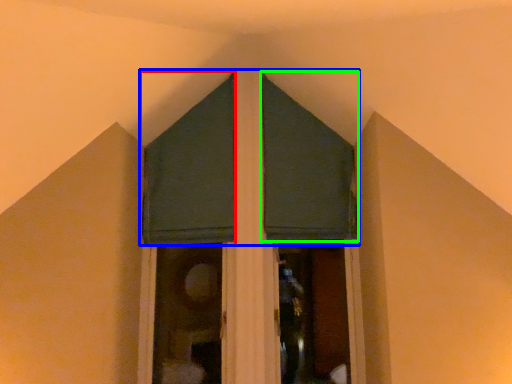
Question: Considering the real-world distances, which object is farthest from curtain (highlighted by a red box)? curtain (highlighted by a blue box) or curtain (highlighted by a green box)?

Choices:
 (A) curtain
 (B) curtain

Answer: (B)